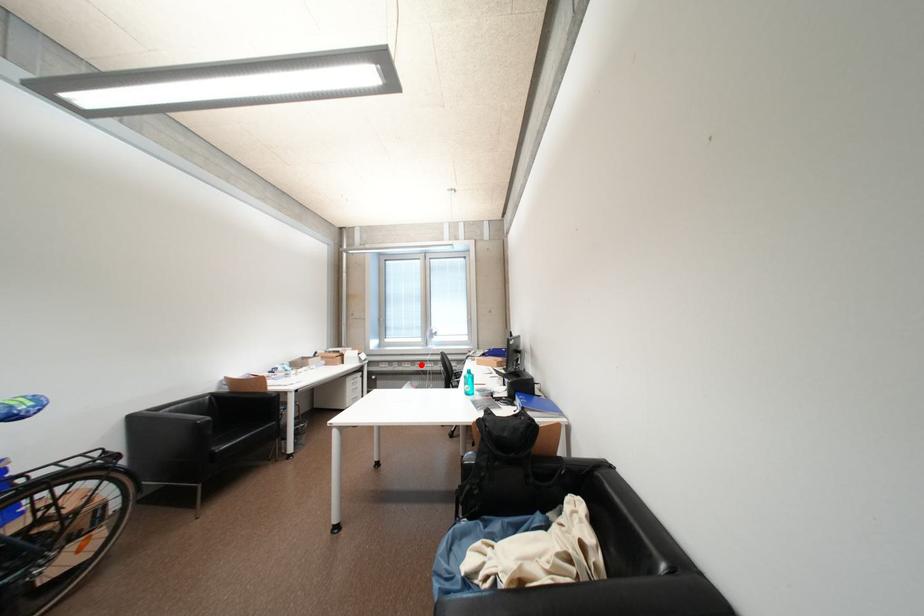
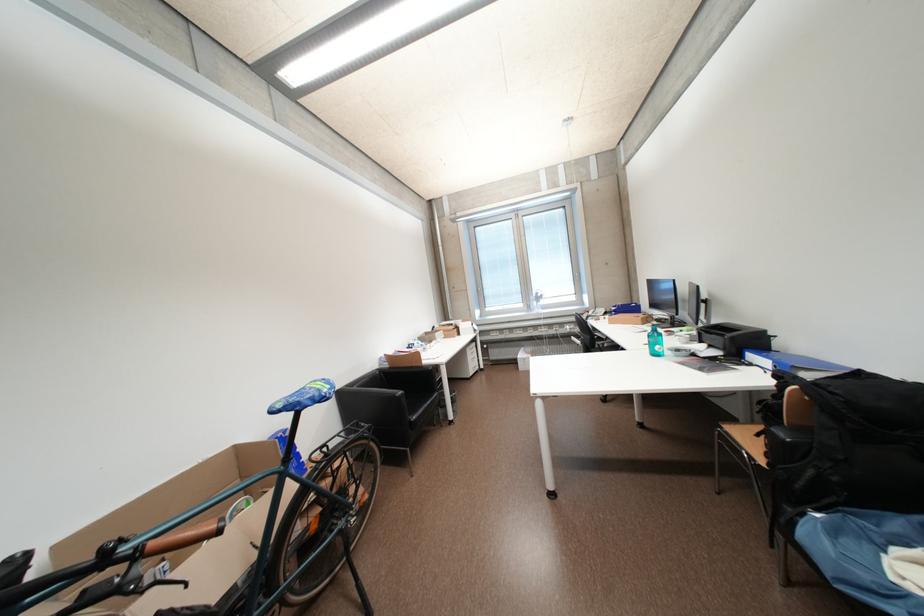
Where in the second image is the point corresponding to the highlighted location from the first image?

(532, 331)